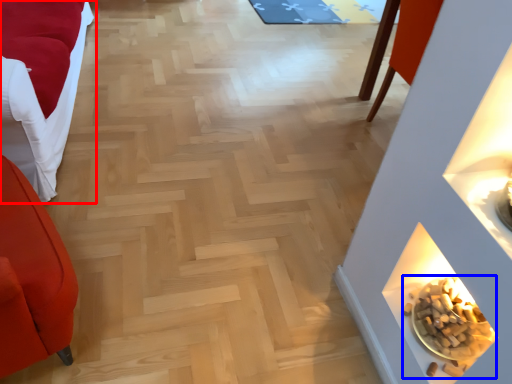
Question: Among these objects, which one is nearest to the camera, furniture (highlighted by a red box) or food (highlighted by a blue box)?

Choices:
 (A) furniture
 (B) food

Answer: (A)